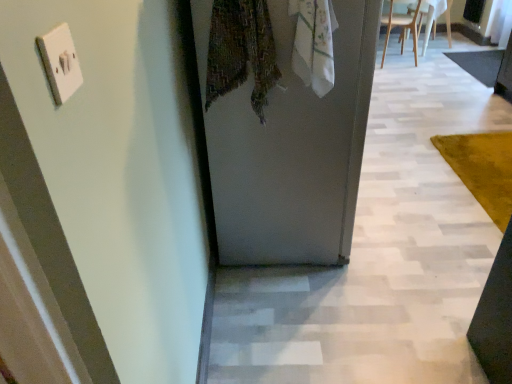
Identify the location of white matte door at center. This screenshot has width=512, height=384. (294, 152).

Find the location of a particular element. The image size is (512, 384). white plastic chair at upper right, the 2th chair positioned from the left is located at coordinates (434, 18).

Based on the photo, how much space does white wooden chair at upper right, which is counted as the 1th chair, starting from the left, occupy horizontally?

white wooden chair at upper right, which is counted as the 1th chair, starting from the left, is 21.66 inches wide.

Identify the location of yellow plush rug at right, the second mat viewed from the back. This screenshot has height=384, width=512. (483, 169).

Where is `white matte door at center`? The image size is (512, 384). white matte door at center is located at coordinates (294, 152).

Is white plastic switch at upper left facing towards white cotton scarf at upper center?

No.

Is white plastic switch at upper left bigger than white cotton scarf at upper center?

No.

Can you confirm if white plastic switch at upper left is taller than white cotton scarf at upper center?

In fact, white plastic switch at upper left may be shorter than white cotton scarf at upper center.

Would you say white plastic switch at upper left is a long distance from white cotton scarf at upper center?

Yes, white plastic switch at upper left is far from white cotton scarf at upper center.

Measure the distance from white wooden chair at upper right, the 2th chair from the right, to white cotton scarf at upper center.

white wooden chair at upper right, the 2th chair from the right, and white cotton scarf at upper center are 11.60 feet apart from each other.

Is white wooden chair at upper right, which is counted as the 1th chair, starting from the left, aimed at white cotton scarf at upper center?

No.

From a real-world perspective, is white wooden chair at upper right, which is counted as the 1th chair, starting from the left, physically below white cotton scarf at upper center?

Yes.

Is white wooden chair at upper right, which is counted as the 1th chair, starting from the left, not close to white cotton scarf at upper center?

Yes.

Who is bigger, white matte door at center or white cotton scarf at upper center?

white matte door at center is bigger.

Does white matte door at center have a lesser height compared to white cotton scarf at upper center?

No, white matte door at center is not shorter than white cotton scarf at upper center.

In the scene shown: Is white matte door at center with white cotton scarf at upper center?

white matte door at center is not next to white cotton scarf at upper center, and they're not touching.

Is white matte door at center positioned beyond the bounds of white cotton scarf at upper center?

Indeed, white matte door at center is completely outside white cotton scarf at upper center.

Is white plastic switch at upper left located within white wooden chair at upper right, the 2th chair from the right?

Definitely not — white plastic switch at upper left is not inside white wooden chair at upper right, the 2th chair from the right.

In the scene shown: Is white wooden chair at upper right, which is counted as the 1th chair, starting from the left, taller or shorter than white plastic switch at upper left?

white wooden chair at upper right, which is counted as the 1th chair, starting from the left, is taller than white plastic switch at upper left.

Considering the relative sizes of white plastic chair at upper right, the first chair positioned from the right, and white cotton scarf at upper center in the image provided, is white plastic chair at upper right, the first chair positioned from the right, wider than white cotton scarf at upper center?

Yes, white plastic chair at upper right, the first chair positioned from the right, is wider than white cotton scarf at upper center.

I want to click on the 2nd chair positioned above the white cotton scarf at upper center (from the image's perspective), so click(x=434, y=18).

Which is closer, [429,19] or [327,77]?

The point [327,77] is closer.

From a real-world perspective, between white plastic chair at upper right, the 2th chair positioned from the left, and white cotton scarf at upper center, who is vertically lower?

From a 3D spatial view, white plastic chair at upper right, the 2th chair positioned from the left, is below.

Starting from the white wooden chair at upper right, the 2th chair from the right, which mat is the 2nd one in front? Please provide its 2D coordinates.

[(483, 169)]

Between point (392, 21) and point (487, 181), which one is positioned in front?

Point (487, 181)

Does white wooden chair at upper right, which is counted as the 1th chair, starting from the left, lie in front of yellow plush rug at right, the second mat viewed from the back?

No, the depth of white wooden chair at upper right, which is counted as the 1th chair, starting from the left, is greater than that of yellow plush rug at right, the second mat viewed from the back.

In terms of height, does white wooden chair at upper right, the 2th chair from the right, look taller or shorter compared to yellow plush rug at right, which is the 2th mat in right-to-left order?

Considering their sizes, white wooden chair at upper right, the 2th chair from the right, has more height than yellow plush rug at right, which is the 2th mat in right-to-left order.

From the image's perspective, is white plastic switch at upper left under yellow plush rug at right, the 1th mat in the front-to-back sequence?

No, from the image's perspective, white plastic switch at upper left is not below yellow plush rug at right, the 1th mat in the front-to-back sequence.

From the picture: Considering the sizes of objects white plastic switch at upper left and yellow plush rug at right, the second mat viewed from the back, in the image provided, who is smaller, white plastic switch at upper left or yellow plush rug at right, the second mat viewed from the back,?

white plastic switch at upper left is smaller.

Is white plastic switch at upper left far from yellow plush rug at right, which is the 1th mat from bottom to top?

Yes, white plastic switch at upper left and yellow plush rug at right, which is the 1th mat from bottom to top, are quite far apart.

Identify the location of electric outlet located above the yellow plush rug at right, the second mat viewed from the back (from a real-world perspective). (60, 62).

You are a GUI agent. You are given a task and a screenshot of the screen. Output one action in this format:
    pyautogui.click(x=<x>, y=<y>)
    Task: Click on the electric outlet on the left of the white cotton scarf at upper center
    The width and height of the screenshot is (512, 384).
    Given the screenshot: What is the action you would take?
    pyautogui.click(x=60, y=62)

Image resolution: width=512 pixels, height=384 pixels. I want to click on the 1st chair positioned below the white cotton scarf at upper center (from a real-world perspective), so click(401, 28).

When comparing their distances from white cotton scarf at upper center, does white wooden chair at upper right, which is counted as the 1th chair, starting from the left, or white plastic chair at upper right, the first chair positioned from the right, seem closer?

white wooden chair at upper right, which is counted as the 1th chair, starting from the left, lies closer to white cotton scarf at upper center than the other object.

Which object lies further to the anchor point textured fabric clothesline at center, white cotton scarf at upper center or white plastic switch at upper left?

Among the two, white plastic switch at upper left is located further to textured fabric clothesline at center.

Based on their spatial positions, is dark gray carpet at right, the 2th mat when ordered from left to right, or white plastic chair at upper right, the first chair positioned from the right, closer to white plastic switch at upper left?

dark gray carpet at right, the 2th mat when ordered from left to right, lies closer to white plastic switch at upper left than the other object.

Based on their spatial positions, is yellow plush rug at right, which is the second mat in top-to-bottom order, or white plastic switch at upper left closer to white matte door at center?

white plastic switch at upper left is closer to white matte door at center.

From the image, which object appears to be nearer to white plastic chair at upper right, the 2th chair positioned from the left, white wooden chair at upper right, the 2th chair from the right, or dark gray carpet at right, the first mat viewed from the right?

Among the two, white wooden chair at upper right, the 2th chair from the right, is located nearer to white plastic chair at upper right, the 2th chair positioned from the left.

Estimate the real-world distances between objects in this image. Which object is further from white cotton scarf at upper center, textured fabric clothesline at center or white plastic switch at upper left?

The object further to white cotton scarf at upper center is white plastic switch at upper left.

Based on their spatial positions, is white plastic chair at upper right, the first chair positioned from the right, or white matte door at center closer to white wooden chair at upper right, which is counted as the 1th chair, starting from the left?

white plastic chair at upper right, the first chair positioned from the right.

When comparing their distances from white cotton scarf at upper center, does white plastic switch at upper left or white matte door at center seem closer?

white matte door at center lies closer to white cotton scarf at upper center than the other object.

You are a GUI agent. You are given a task and a screenshot of the screen. Output one action in this format:
    pyautogui.click(x=<x>, y=<y>)
    Task: Click on the scarf between white plastic switch at upper left and yellow plush rug at right, which is the 1th mat from bottom to top, in the horizontal direction
    The height and width of the screenshot is (384, 512).
    Given the screenshot: What is the action you would take?
    pyautogui.click(x=314, y=43)

Where is `door located between textured fabric clothesline at center and white cotton scarf at upper center in the left-right direction`? This screenshot has height=384, width=512. door located between textured fabric clothesline at center and white cotton scarf at upper center in the left-right direction is located at coordinates (294, 152).

Find the location of a particular element. door positioned between textured fabric clothesline at center and white plastic chair at upper right, the first chair positioned from the right, from near to far is located at coordinates (294, 152).

At what (x,y) coordinates should I click in order to perform the action: click on chair between textured fabric clothesline at center and white plastic chair at upper right, the first chair positioned from the right, in the front-back direction. Please return your answer as a coordinate pair (x, y). The image size is (512, 384). Looking at the image, I should click on (401, 28).